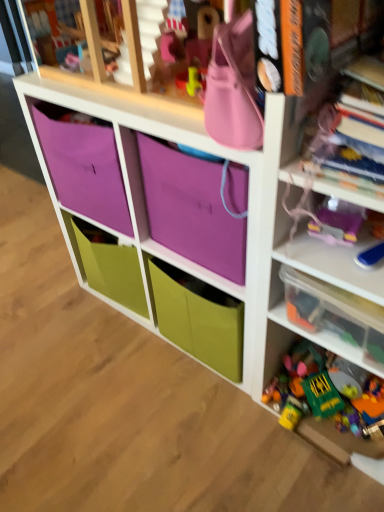
Find the location of `vacant space in front of purple fabric storage at center`. vacant space in front of purple fabric storage at center is located at coordinates (161, 428).